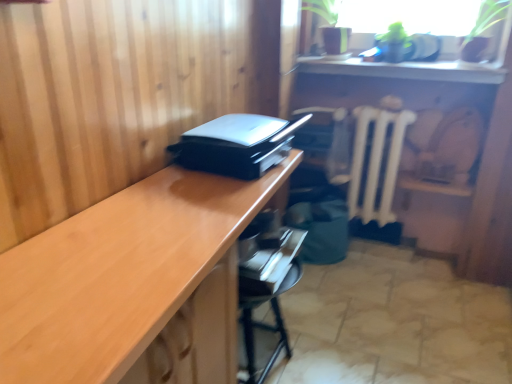
Image resolution: width=512 pixels, height=384 pixels. What do you see at coordinates (266, 286) in the screenshot? I see `metallic black drawer at lower center` at bounding box center [266, 286].

Measure the distance between metallic black drawer at lower center and camera.

They are 1.10 meters apart.

This screenshot has height=384, width=512. I want to click on black plastic printer at center, so click(236, 145).

Identify the location of white glossy counter top at upper right. (406, 70).

I want to click on glossy wood desk at center, so click(x=133, y=284).

Describe the element at coordinates (133, 284) in the screenshot. The width and height of the screenshot is (512, 384). I see `glossy wood desk at center` at that location.

Find the location of a particular element. The width and height of the screenshot is (512, 384). white matte radiator at center is located at coordinates (376, 162).

From the image's perspective, which one is positioned lower, glossy wood desk at center or black plastic printer at center?

glossy wood desk at center, from the image's perspective.

Does glossy wood desk at center have a lesser width compared to black plastic printer at center?

In fact, glossy wood desk at center might be wider than black plastic printer at center.

Is point (186, 203) farther from camera compared to point (267, 119)?

No, it is in front of (267, 119).

Does glossy wood desk at center have a smaller size compared to black plastic printer at center?

Incorrect, glossy wood desk at center is not smaller in size than black plastic printer at center.

Is white glossy counter top at upper right at the left side of black plastic drawer at center?

Incorrect, white glossy counter top at upper right is not on the left side of black plastic drawer at center.

This screenshot has width=512, height=384. What are the coordinates of `drawer below the white glossy counter top at upper right (from a real-world perspective)` in the screenshot? It's located at (313, 138).

Can you tell me how much white glossy counter top at upper right and black plastic drawer at center differ in facing direction?

They differ by 6.25 degrees in their facing directions.

Who is bigger, black plastic printer at center or black plastic drawer at center?

Bigger between the two is black plastic printer at center.

From a real-world perspective, is black plastic printer at center beneath black plastic drawer at center?

Actually, black plastic printer at center is physically above black plastic drawer at center in the real world.

From the image's perspective, which one is positioned lower, black plastic printer at center or black plastic drawer at center?

From the image's view, black plastic printer at center is below.

Is point (182, 143) less distant than point (332, 129)?

Yes, point (182, 143) is in front of point (332, 129).

Locate an element on the screen. desk that is under the white glossy counter top at upper right (from a real-world perspective) is located at coordinates (133, 284).

Is white glossy counter top at upper right at the back of glossy wood desk at center?

glossy wood desk at center does not have its back to white glossy counter top at upper right.

From a real-world perspective, which object rests below the other?

From a 3D spatial view, glossy wood desk at center is below.

Does point (26, 356) come in front of point (421, 71)?

Yes, point (26, 356) is closer to viewer.

This screenshot has height=384, width=512. What are the coordinates of `drawer lying above the metallic black drawer at lower center (from the image's perspective)` in the screenshot? It's located at (313, 138).

How far apart are black plastic drawer at center and metallic black drawer at lower center?

black plastic drawer at center is 86.51 centimeters away from metallic black drawer at lower center.

Is black plastic drawer at center further to the viewer compared to metallic black drawer at lower center?

Yes, the depth of black plastic drawer at center is greater than that of metallic black drawer at lower center.

How different are the orientations of metallic black drawer at lower center and white glossy counter top at upper right in degrees?

They differ by 93 degrees in their facing directions.

Between point (285, 278) and point (395, 72), which one is positioned in front?

Positioned in front is point (285, 278).

Considering the relative positions of metallic black drawer at lower center and white glossy counter top at upper right in the image provided, is metallic black drawer at lower center in front of white glossy counter top at upper right?

Yes, metallic black drawer at lower center is in front of white glossy counter top at upper right.

Is metallic black drawer at lower center oriented towards white glossy counter top at upper right?

No, metallic black drawer at lower center is not turned towards white glossy counter top at upper right.

Looking at this image, does white matte radiator at center turn towards glossy wood desk at center?

Yes, white matte radiator at center is facing glossy wood desk at center.

Consider the image. Is white matte radiator at center not inside glossy wood desk at center?

Indeed, white matte radiator at center is completely outside glossy wood desk at center.

From the image's perspective, which one is positioned higher, white matte radiator at center or glossy wood desk at center?

white matte radiator at center is shown above in the image.

At what (x,y) coordinates should I click in order to perform the action: click on desk that is on the left side of black plastic printer at center. Please return your answer as a coordinate pair (x, y). The width and height of the screenshot is (512, 384). Looking at the image, I should click on (133, 284).

Image resolution: width=512 pixels, height=384 pixels. What are the coordinates of `counter top above the black plastic drawer at center (from the image's perspective)` in the screenshot? It's located at (406, 70).

Based on their spatial positions, is metallic black drawer at lower center or white matte radiator at center closer to black plastic drawer at center?

The object closer to black plastic drawer at center is white matte radiator at center.

Based on the photo, from the image, which object appears to be nearer to glossy wood desk at center, black plastic drawer at center or white matte radiator at center?

Among the two, white matte radiator at center is located nearer to glossy wood desk at center.

Based on their spatial positions, is white matte radiator at center or black plastic printer at center further from black plastic drawer at center?

Based on the image, black plastic printer at center appears to be further to black plastic drawer at center.

Consider the image. Estimate the real-world distances between objects in this image. Which object is closer to white matte radiator at center, black plastic drawer at center or metallic black drawer at lower center?

black plastic drawer at center is positioned closer to the anchor white matte radiator at center.

From the image, which object appears to be farther from black plastic printer at center, white matte radiator at center or metallic black drawer at lower center?

Among the two, white matte radiator at center is located further to black plastic printer at center.

When comparing their distances from black plastic printer at center, does metallic black drawer at lower center or white matte radiator at center seem closer?

Based on the image, metallic black drawer at lower center appears to be nearer to black plastic printer at center.

Looking at the image, which one is located closer to white matte radiator at center, metallic black drawer at lower center or black plastic printer at center?

Among the two, black plastic printer at center is located nearer to white matte radiator at center.

Based on their spatial positions, is metallic black drawer at lower center or black plastic printer at center further from white glossy counter top at upper right?

The object further to white glossy counter top at upper right is metallic black drawer at lower center.

Find the location of a particular element. This screenshot has height=384, width=512. radiator located between glossy wood desk at center and black plastic drawer at center in the depth direction is located at coordinates (376, 162).

This screenshot has height=384, width=512. I want to click on furniture located between black plastic printer at center and white matte radiator at center in the depth direction, so pos(266,286).

At what (x,y) coordinates should I click in order to perform the action: click on radiator between white glossy counter top at upper right and metallic black drawer at lower center in the vertical direction. Please return your answer as a coordinate pair (x, y). Looking at the image, I should click on (376, 162).

Find the location of a particular element. The image size is (512, 384). printer between white glossy counter top at upper right and metallic black drawer at lower center in the up-down direction is located at coordinates (236, 145).